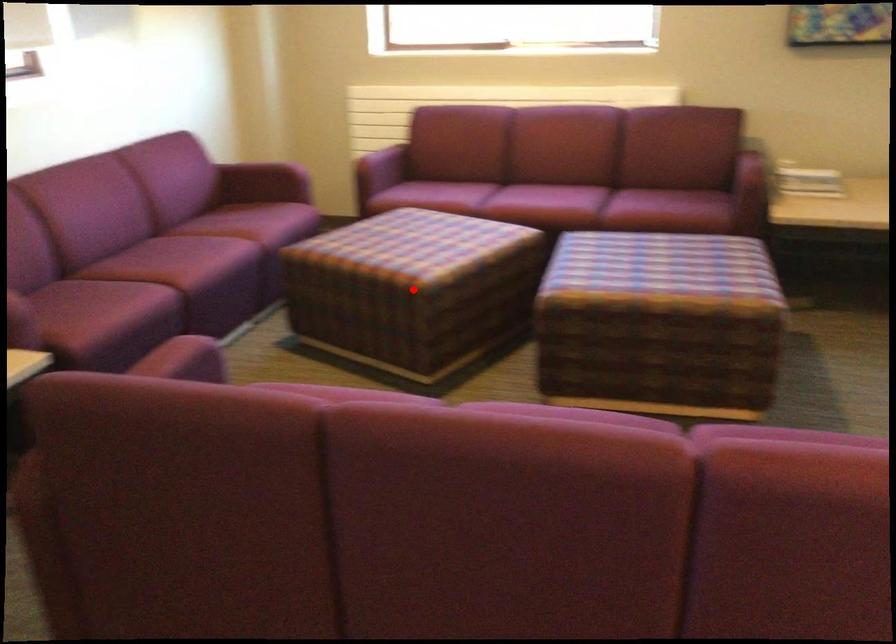
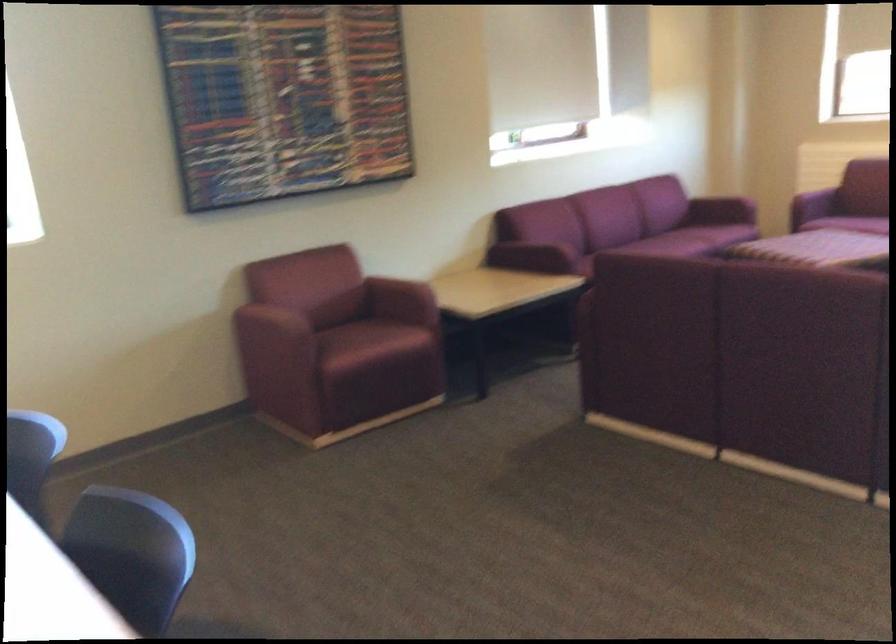
Question: I am providing you with two images of the same scene from different viewpoints. A red point is marked on the first image. At the location where the point appears in image 1, is it still visible in image 2?

Choices:
 (A) Yes
 (B) No

Answer: (B)